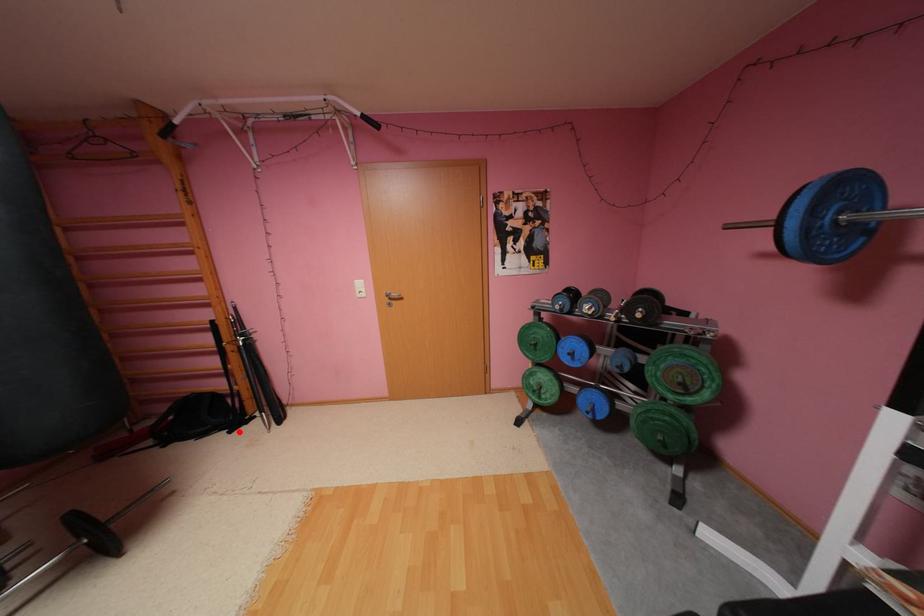
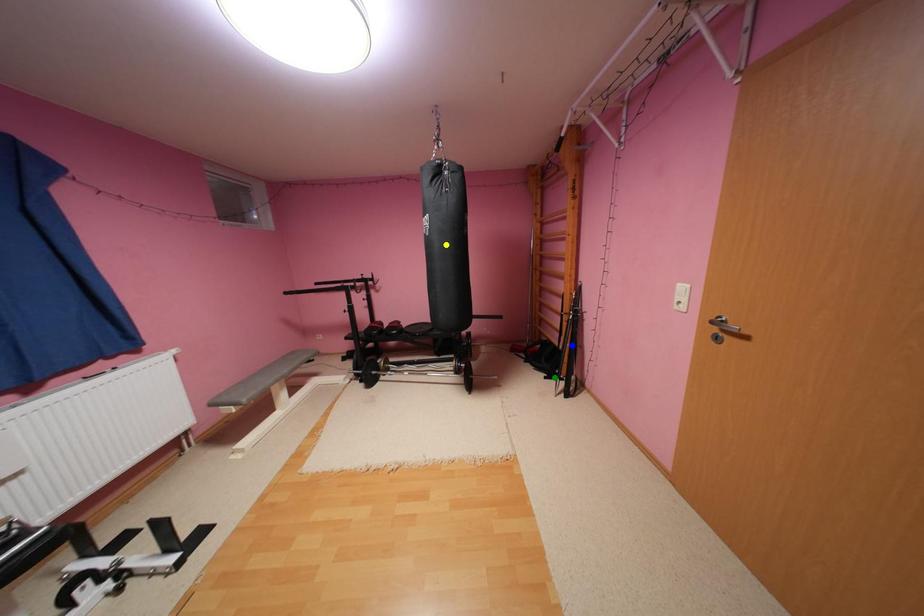
Question: I am providing you with two images of the same scene from different viewpoints. A red point is marked on the first image. You are given multiple points on the second image. In image 2, which mark is for the same physical point as the one in image 1?

Choices:
 (A) green point
 (B) yellow point
 (C) blue point

Answer: (A)